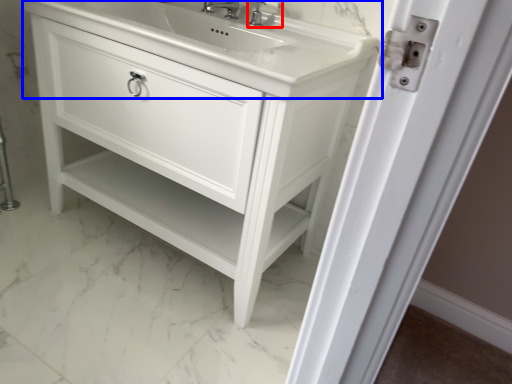
Question: Which object appears closest to the camera in this image, tap (highlighted by a red box) or counter top (highlighted by a blue box)?

Choices:
 (A) tap
 (B) counter top

Answer: (B)